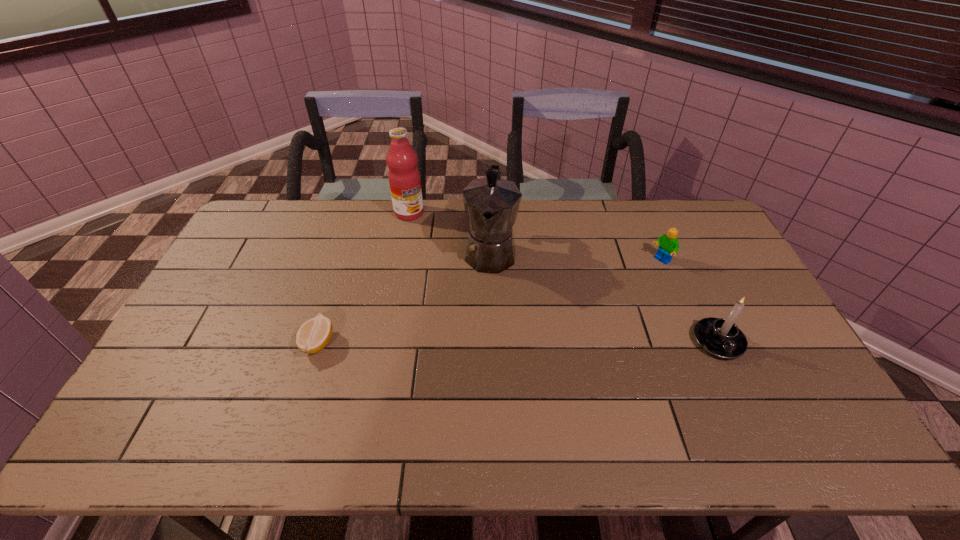
Identify the location of vacant region between the candle holder and the third object from left to right. This screenshot has height=540, width=960. (604, 296).

This screenshot has width=960, height=540. Identify the location of vacant point located between the lemon and the candle holder. tap(518, 342).

Image resolution: width=960 pixels, height=540 pixels. I want to click on unoccupied position between the fruit juice and the second shortest object, so click(535, 237).

Find the location of a particular element. The width and height of the screenshot is (960, 540). free space between the coffeepot and the farthest object is located at coordinates (449, 232).

This screenshot has height=540, width=960. Find the location of `vacant region between the leftmost object and the fruit juice`. vacant region between the leftmost object and the fruit juice is located at coordinates (364, 278).

Find the location of a particular element. free spot between the leftmost object and the second object from left to right is located at coordinates (364, 278).

Where is `vacant space that is in between the candle holder and the coffeepot`? vacant space that is in between the candle holder and the coffeepot is located at coordinates (604, 296).

The width and height of the screenshot is (960, 540). Identify the location of the second closest object relative to the leftmost object. pyautogui.click(x=404, y=178).

Select which object appears as the fourth closest to the Lego. Please provide its 2D coordinates. Your answer should be formatted as a tuple, i.e. [(x, y)], where the tuple contains the x and y coordinates of a point satisfying the conditions above.

[(313, 336)]

Locate an element on the screen. vacant area that satisfies the following two spatial constraints: 1. on the back side of the leftmost object; 2. on the right side of the fruit juice is located at coordinates (360, 213).